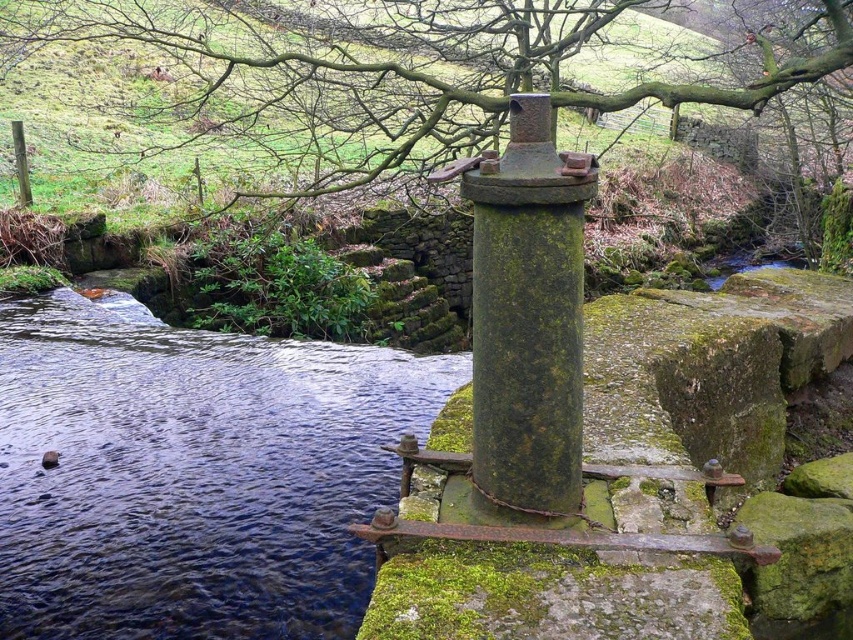
Question: Based on their relative distances, which object is nearer to the green mossy tree at center?

Choices:
 (A) green mossy stone at center
 (B) green mossy stone at lower left

Answer: (B)

Question: Does green mossy tree at center have a greater width compared to green mossy stone at center?

Choices:
 (A) no
 (B) yes

Answer: (B)

Question: Which of the following is the farthest from the observer?

Choices:
 (A) green mossy stone at lower left
 (B) green mossy tree at center
 (C) green mossy stone at center

Answer: (A)

Question: Does green mossy stone at lower left appear over green mossy tree at center?

Choices:
 (A) yes
 (B) no

Answer: (B)

Question: Which point is farther from the camera taking this photo?

Choices:
 (A) pyautogui.click(x=491, y=211)
 (B) pyautogui.click(x=387, y=353)
 (C) pyautogui.click(x=141, y=38)

Answer: (C)

Question: Can you confirm if green mossy stone at lower left is wider than green mossy tree at center?

Choices:
 (A) no
 (B) yes

Answer: (A)